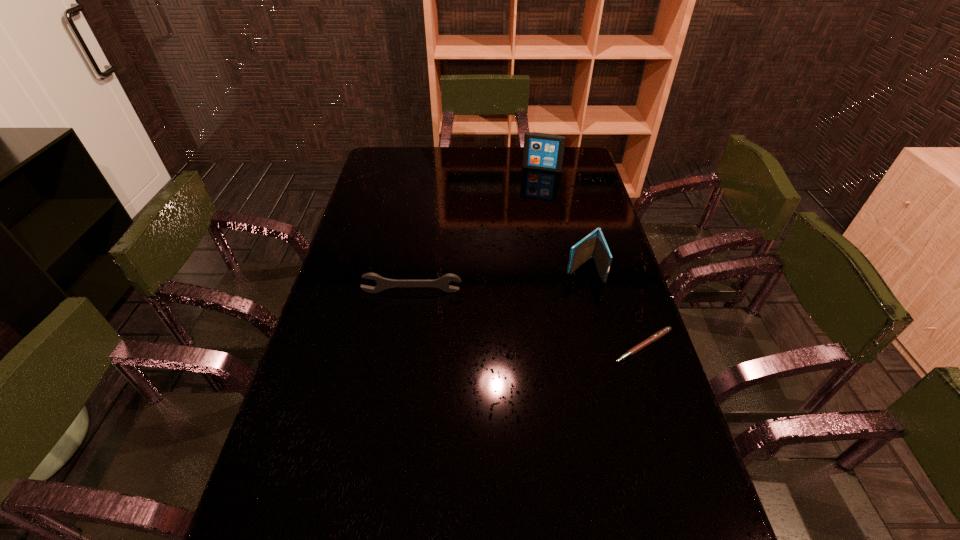
Find the location of a particular element. the third farthest object is located at coordinates click(383, 283).

Image resolution: width=960 pixels, height=540 pixels. What are the coordinates of `the leftmost object` in the screenshot? It's located at (383, 283).

At what (x,y) coordinates should I click in order to perform the action: click on the nearest object. Please return your answer as a coordinate pair (x, y). Looking at the image, I should click on (664, 331).

This screenshot has height=540, width=960. In order to click on pen in this screenshot , I will do `click(664, 331)`.

I want to click on the second tallest object, so click(594, 245).

In order to click on the third nearest object in this screenshot , I will do `click(594, 245)`.

Locate an element on the screen. Image resolution: width=960 pixels, height=540 pixels. the farthest object is located at coordinates (542, 151).

Find the location of a particular element. The width and height of the screenshot is (960, 540). the tallest object is located at coordinates (542, 151).

What are the coordinates of `vacant region located 0.390m on the open ends of the leftmost object` in the screenshot? It's located at (394, 410).

The image size is (960, 540). I want to click on free space located 0.270m at the nib of the shortest object, so click(x=684, y=468).